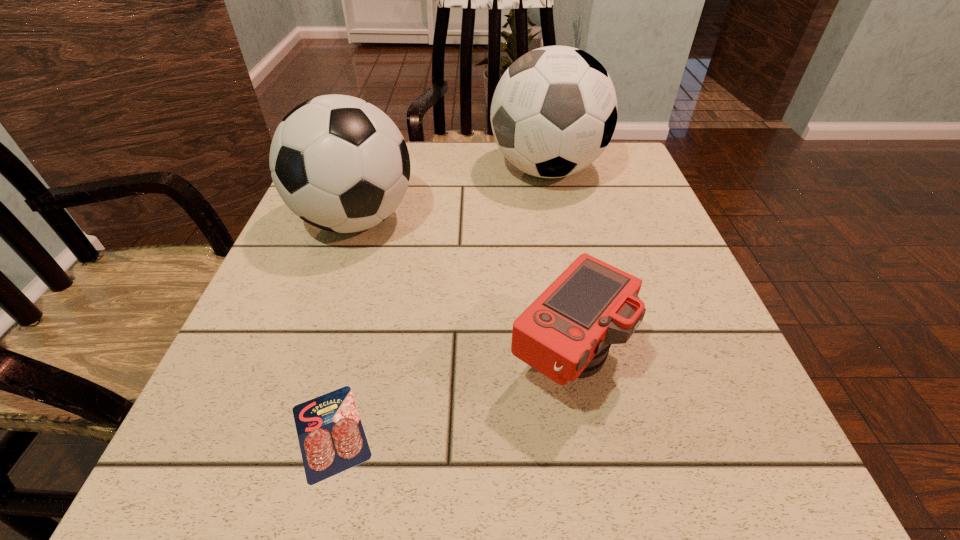
Find the location of a particular element. the right soccer ball is located at coordinates (554, 111).

This screenshot has height=540, width=960. What are the coordinates of `the left soccer ball` in the screenshot? It's located at (338, 162).

Image resolution: width=960 pixels, height=540 pixels. What are the coordinates of `camera` in the screenshot? It's located at (565, 334).

Where is `the shortest object`? the shortest object is located at coordinates [331, 436].

Find the location of a particular element. free space located on the main logo of the right soccer ball is located at coordinates (363, 170).

Locate an element on the screen. vacant area situated 0.320m on the main logo of the right soccer ball is located at coordinates (359, 170).

The image size is (960, 540). I want to click on free spot located on the main logo of the right soccer ball, so click(x=359, y=170).

Where is `vacant space situated 0.260m on the front of the left soccer ball`? vacant space situated 0.260m on the front of the left soccer ball is located at coordinates (302, 377).

At what (x,y) coordinates should I click in order to perform the action: click on vacant space located 0.070m on the right of the third tallest object. Please return your answer as a coordinate pair (x, y). The width and height of the screenshot is (960, 540). Looking at the image, I should click on (674, 361).

The width and height of the screenshot is (960, 540). Identify the location of vacant position located 0.130m on the left of the salami. (188, 431).